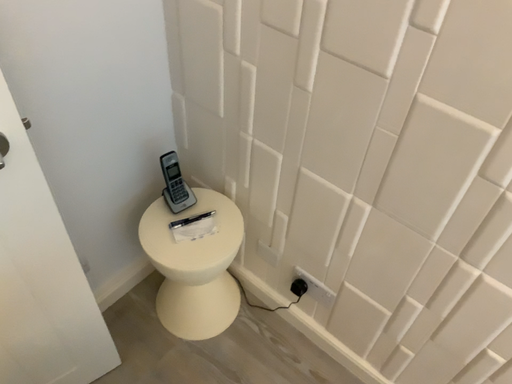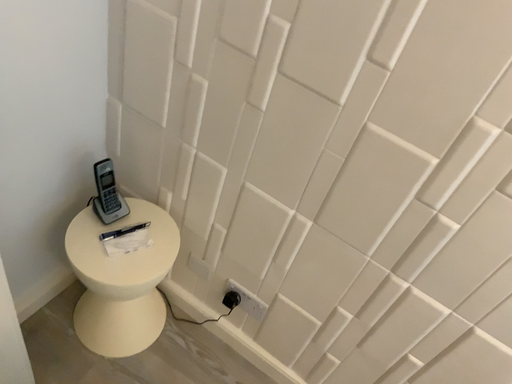
Question: Which way did the camera rotate in the video?

Choices:
 (A) rotated right
 (B) rotated left

Answer: (A)